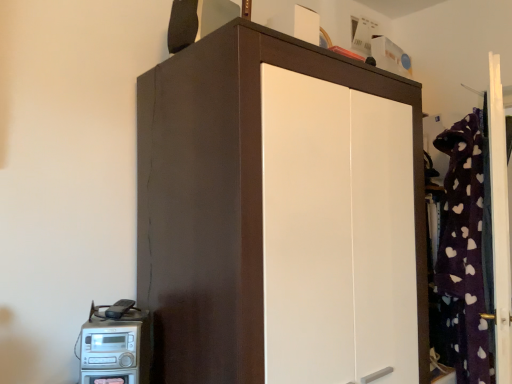
Question: Is matte brown cupboard at center wider or thinner than satin silver radio at lower left?

Choices:
 (A) wide
 (B) thin

Answer: (A)

Question: From a real-world perspective, is matte brown cupboard at center above or below satin silver radio at lower left?

Choices:
 (A) below
 (B) above

Answer: (B)

Question: In the image, is matte brown cupboard at center on the left side or the right side of satin silver radio at lower left?

Choices:
 (A) left
 (B) right

Answer: (B)

Question: In terms of height, does satin silver radio at lower left look taller or shorter compared to matte brown cupboard at center?

Choices:
 (A) short
 (B) tall

Answer: (A)

Question: From the image's perspective, relative to matte brown cupboard at center, is satin silver radio at lower left above or below?

Choices:
 (A) below
 (B) above

Answer: (A)

Question: Considering the positions of satin silver radio at lower left and matte brown cupboard at center in the image, is satin silver radio at lower left wider or thinner than matte brown cupboard at center?

Choices:
 (A) wide
 (B) thin

Answer: (B)

Question: In terms of size, does satin silver radio at lower left appear bigger or smaller than matte brown cupboard at center?

Choices:
 (A) small
 (B) big

Answer: (A)